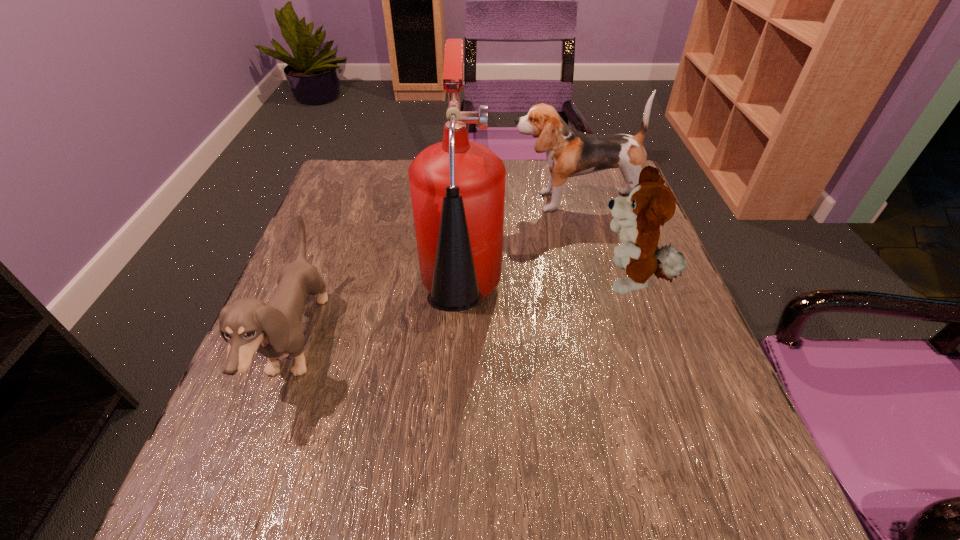
The image size is (960, 540). What are the coordinates of `puppy that can be found as the second closest to the leftmost object` in the screenshot? It's located at (650, 204).

Identify which puppy is located as the nearest to the second object from left to right. Please provide its 2D coordinates. Your answer should be formatted as a tuple, i.e. [(x, y)], where the tuple contains the x and y coordinates of a point satisfying the conditions above.

[(570, 153)]

Identify the location of vacant point that satisfies the following two spatial constraints: 1. at the face of the tallest puppy; 2. with the nozzle aimed from the second object from left to right. (603, 307).

Where is `free spot that satisfies the following two spatial constraints: 1. with the nozzle aimed from the fire extinguisher; 2. at the face of the shortest object`? The image size is (960, 540). free spot that satisfies the following two spatial constraints: 1. with the nozzle aimed from the fire extinguisher; 2. at the face of the shortest object is located at coordinates (459, 342).

You are a GUI agent. You are given a task and a screenshot of the screen. Output one action in this format:
    pyautogui.click(x=<x>, y=<y>)
    Task: Click on the free space in the image that satisfies the following two spatial constraints: 1. at the face of the farthest object; 2. with the nozzle aimed from the second object from left to right
    
    Given the screenshot: What is the action you would take?
    pyautogui.click(x=603, y=307)

At what (x,y) coordinates should I click in order to perform the action: click on vacant space that satisfies the following two spatial constraints: 1. at the face of the tallest puppy; 2. with the nozzle aimed from the fire extinguisher. Please return your answer as a coordinate pair (x, y). The width and height of the screenshot is (960, 540). Looking at the image, I should click on (603, 307).

Find the location of a particular element. The width and height of the screenshot is (960, 540). vacant space that satisfies the following two spatial constraints: 1. on the face of the second shortest object; 2. with the nozzle aimed from the second object from left to right is located at coordinates (638, 307).

Locate an element on the screen. vacant space that satisfies the following two spatial constraints: 1. with the nozzle aimed from the tallest object; 2. at the face of the leftmost object is located at coordinates (459, 342).

You are a GUI agent. You are given a task and a screenshot of the screen. Output one action in this format:
    pyautogui.click(x=<x>, y=<y>)
    Task: Click on the free space in the image that satisfies the following two spatial constraints: 1. on the face of the third tallest object; 2. with the nozzle aimed from the second object from left to right
    The image size is (960, 540).
    Given the screenshot: What is the action you would take?
    pyautogui.click(x=638, y=307)